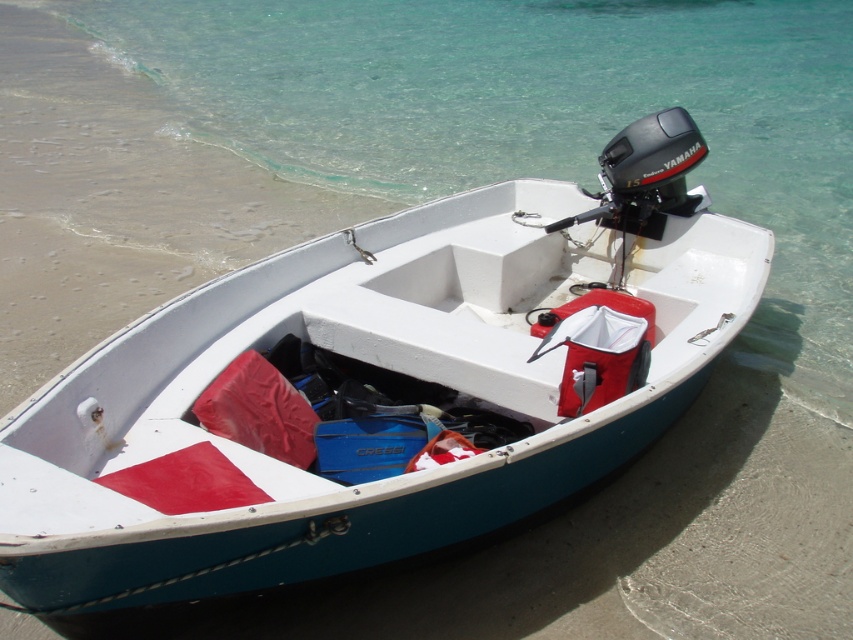
Is white matte boat at center to the right of clear water at lower center from the viewer's perspective?

Incorrect, white matte boat at center is not on the right side of clear water at lower center.

The image size is (853, 640). What do you see at coordinates (376, 388) in the screenshot? I see `white matte boat at center` at bounding box center [376, 388].

Image resolution: width=853 pixels, height=640 pixels. In order to click on white matte boat at center in this screenshot , I will do `click(376, 388)`.